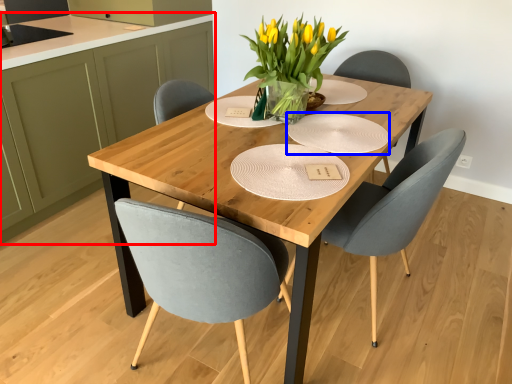
Question: Which object appears farthest to the camera in this image, cabinetry (highlighted by a red box) or paper plate (highlighted by a blue box)?

Choices:
 (A) cabinetry
 (B) paper plate

Answer: (A)